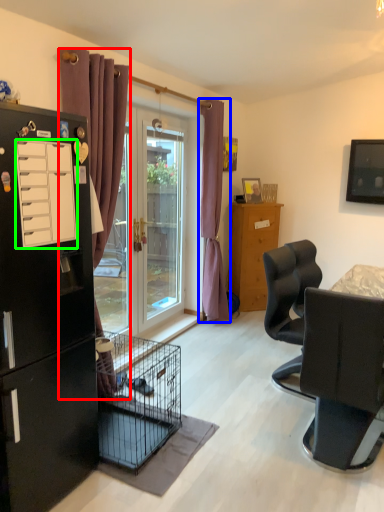
Question: Which object is positioned closest to curtain (highlighted by a red box)? Select from curtain (highlighted by a blue box) and drawer (highlighted by a green box).

Choices:
 (A) curtain
 (B) drawer

Answer: (B)